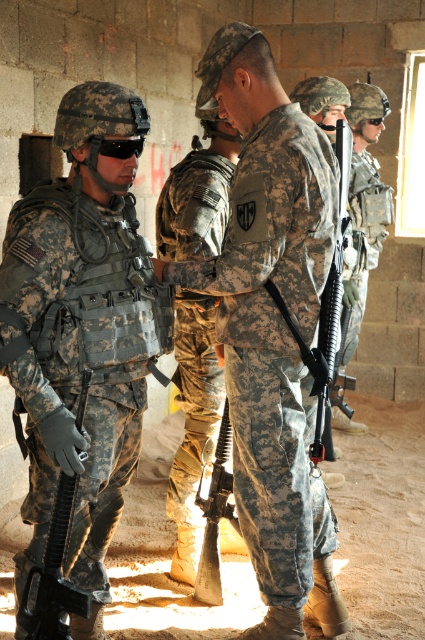
What do you see at coordinates (365, 230) in the screenshot? I see `camouflage fabric uniform at right` at bounding box center [365, 230].

Which is behind, point (365, 157) or point (204, 502)?

Positioned behind is point (365, 157).

You are a GUI agent. You are given a task and a screenshot of the screen. Output one action in this format:
    pyautogui.click(x=<x>, y=<y>)
    Task: Click on the camouflage fabric uniform at right
    The height and width of the screenshot is (640, 425).
    Given the screenshot: What is the action you would take?
    pyautogui.click(x=365, y=230)

Between camouflage fabric uniform at center and black matte rifle at center, which one has less height?

With less height is black matte rifle at center.

In order to click on camouflage fabric uniform at center in this screenshot , I will do `click(193, 400)`.

Does camouflage uniform at center have a greater width compared to camouflage fabric uniform at right?

Yes, camouflage uniform at center is wider than camouflage fabric uniform at right.

Between camouflage uniform at center and camouflage fabric uniform at right, which one appears on the right side from the viewer's perspective?

camouflage fabric uniform at right

Does point (241, 108) come closer to viewer compared to point (362, 276)?

Yes, it is.

At what (x,y) coordinates should I click in order to perform the action: click on camouflage uniform at center. Please return your answer as a coordinate pair (x, y). The width and height of the screenshot is (425, 640). Looking at the image, I should click on (272, 330).